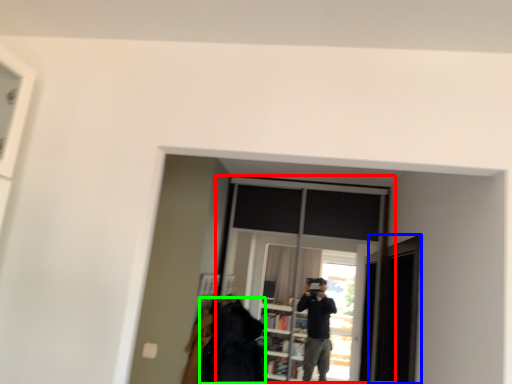
Question: Which object is positioned farthest from window (highlighted by a red box)? Select from screen door (highlighted by a blue box) and clothing (highlighted by a green box).

Choices:
 (A) screen door
 (B) clothing

Answer: (A)